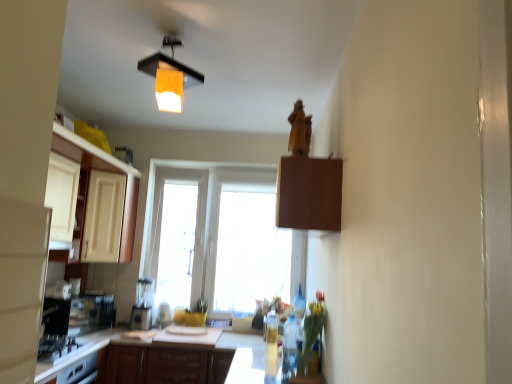
Question: In terms of height, does wooden panel at upper center look taller or shorter compared to translucent plastic bottle at center, acting as the 2th bottle starting from the front?

Choices:
 (A) short
 (B) tall

Answer: (B)

Question: Looking at their shapes, would you say wooden panel at upper center is wider or thinner than translucent plastic bottle at center, the first bottle positioned from the back?

Choices:
 (A) wide
 (B) thin

Answer: (A)

Question: Estimate the real-world distances between objects in this image. Which object is farther from the wooden cabinet at center, which appears as the 2th cabinetry when viewed from the front?

Choices:
 (A) translucent glass vase at lower center
 (B) brown matte cabinet at upper center, which appears as the first cabinetry when viewed from the right
 (C) translucent plastic bottle at center, the first bottle positioned from the back
 (D) translucent plastic bottle at lower center, the second bottle in the back-to-front sequence
 (E) matte white cabinet at left, which appears as the third cabinetry when viewed from the right

Answer: (B)

Question: Based on their relative distances, which object is farther from the translucent glass vase at lower center?

Choices:
 (A) translucent plastic bottle at center, acting as the 2th bottle starting from the front
 (B) matte white cabinet at left, the second cabinetry from the top
 (C) matte white blender at center
 (D) translucent plastic bottle at lower center, the first bottle from the front
 (E) wooden cabinet at center, marked as the first cabinetry in a bottom-to-top arrangement

Answer: (B)